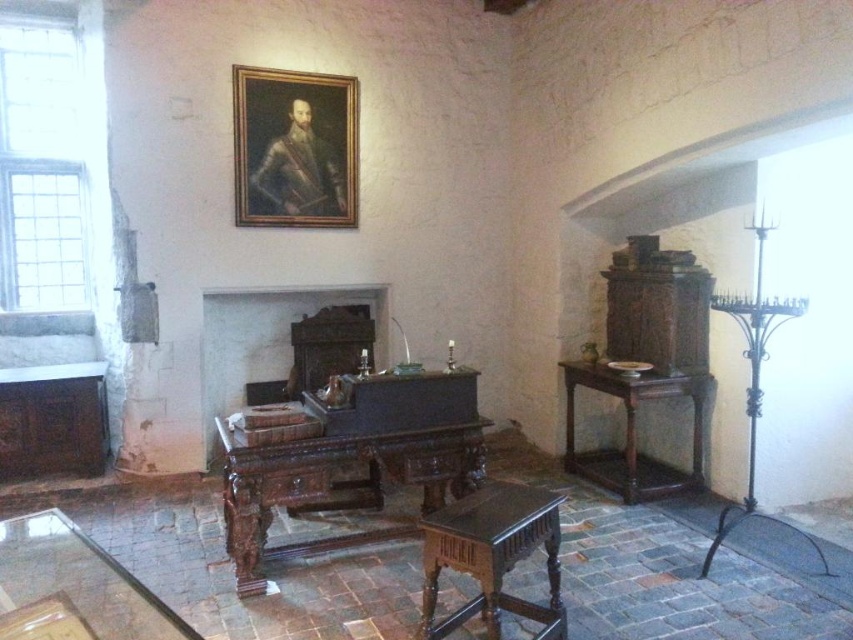
You are standing in the room and want to reach both points. Which point, point (370, 538) or point (701, 413), is closer to you?

Point (370, 538) is closer to you than point (701, 413).

You are standing in the room and want to place a new rug. The rug needs to be centered exactly at the same position as the dark wood fireplace at center. According to the scene description, where should you place the rug?

The rug should be placed at point (265, 340) to match the location of the dark wood fireplace at center.

You are standing in the room and want to place a small book on the dark brown wood stool at center and the dark wood side table at right. Which object is located to the left of the other?

The dark brown wood stool at center is positioned on the left side of dark wood side table at right, so the dark brown wood stool at center is to the left of the dark wood side table at right.